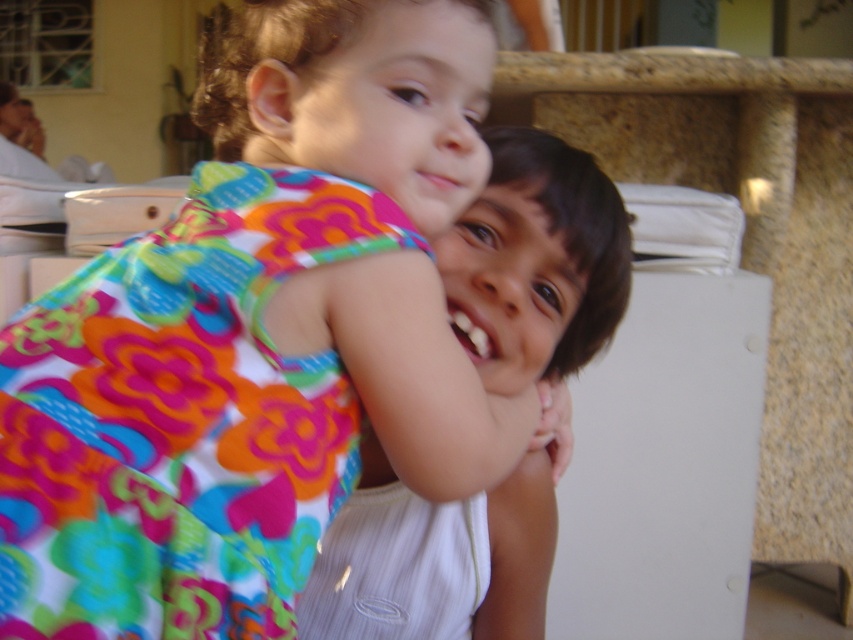
Question: Can you confirm if floral fabric dress at center is wider than smooth white shirt at center?

Choices:
 (A) no
 (B) yes

Answer: (B)

Question: Which point is closer to the camera?

Choices:
 (A) smooth white shirt at center
 (B) floral fabric dress at center

Answer: (B)

Question: Is floral fabric dress at center bigger than smooth white shirt at center?

Choices:
 (A) no
 (B) yes

Answer: (B)

Question: Which point appears closest to the camera in this image?

Choices:
 (A) (206, 340)
 (B) (457, 294)

Answer: (A)

Question: Is floral fabric dress at center wider than smooth white shirt at center?

Choices:
 (A) yes
 (B) no

Answer: (A)